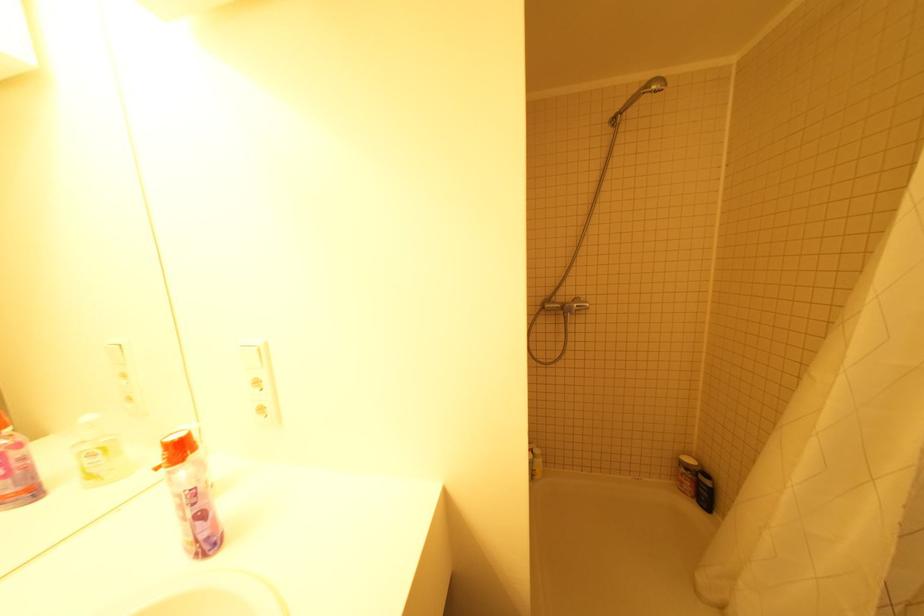
The height and width of the screenshot is (616, 924). I want to click on soap dispenser pump, so click(176, 448).